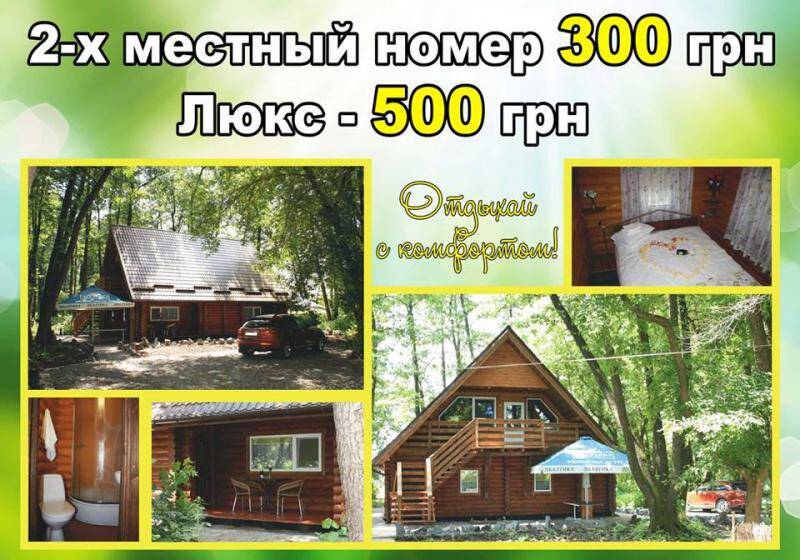
Identify the location of stairs. (410, 506).